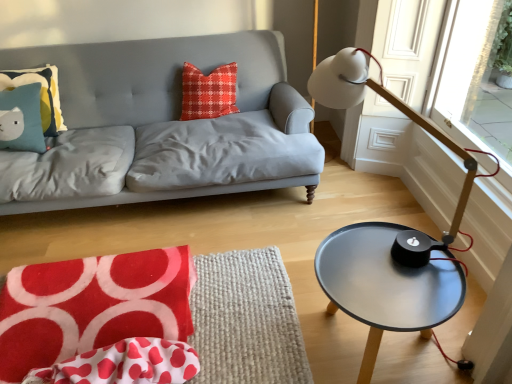
Locate an element on the screen. free spot to the right of white polka dot fabric at lower left is located at coordinates (240, 344).